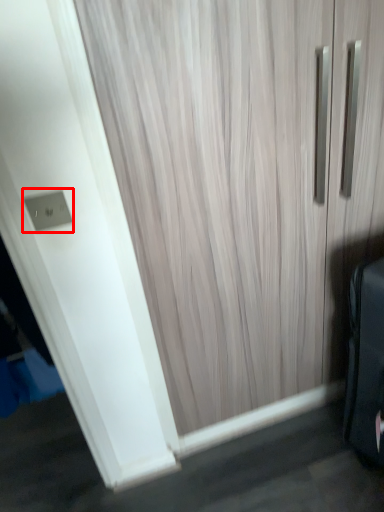
Question: From the image's perspective, considering the relative positions of electric outlet (annotated by the red box) and door in the image provided, where is electric outlet (annotated by the red box) located with respect to the staircase?

Choices:
 (A) above
 (B) below

Answer: (A)